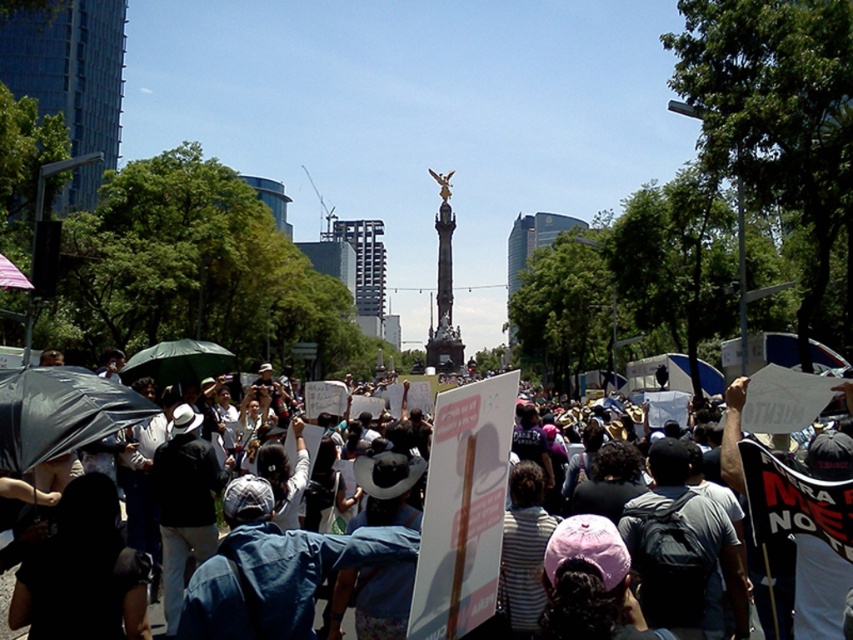
Who is positioned more to the right, denim jacket at center or matte black umbrella at left?

From the viewer's perspective, denim jacket at center appears more on the right side.

Can you confirm if denim jacket at center is positioned to the left of matte black umbrella at left?

Incorrect, denim jacket at center is not on the left side of matte black umbrella at left.

Who is more forward, (183, 625) or (56, 380)?

Point (183, 625) is in front.

The image size is (853, 640). Find the location of `denim jacket at center`. denim jacket at center is located at coordinates (274, 570).

Describe the element at coordinates (274, 570) in the screenshot. I see `denim jacket at center` at that location.

Which is more to the right, denim jacket at center or green matte umbrella at center?

denim jacket at center

Who is more forward, (335, 570) or (184, 378)?

Point (335, 570) is in front.

Locate an element on the screen. This screenshot has height=640, width=853. denim jacket at center is located at coordinates (274, 570).

Does point (178, 348) come behind point (6, 602)?

Yes, it is behind point (6, 602).

Can you confirm if green matte umbrella at center is shorter than denim jacket at lower left?

Correct, green matte umbrella at center is not as tall as denim jacket at lower left.

Identify the location of green matte umbrella at center. (x=177, y=362).